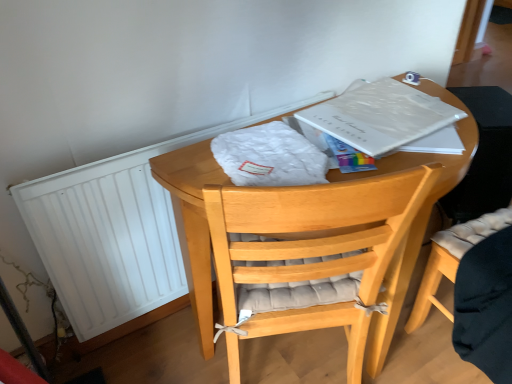
Question: Considering their positions, is white matte radiator at left located in front of or behind white paper at upper right?

Choices:
 (A) behind
 (B) front

Answer: (A)

Question: Is white matte radiator at left spatially inside white paper at upper right, or outside of it?

Choices:
 (A) outside
 (B) inside

Answer: (A)

Question: Which object is the farthest from the white paper at upper right?

Choices:
 (A) light brown wooden chair at center
 (B) wooden round table at center
 (C) white matte radiator at left

Answer: (C)

Question: Which is farther from the wooden round table at center?

Choices:
 (A) white paper at upper right
 (B) light brown wooden chair at center
 (C) white matte radiator at left

Answer: (B)